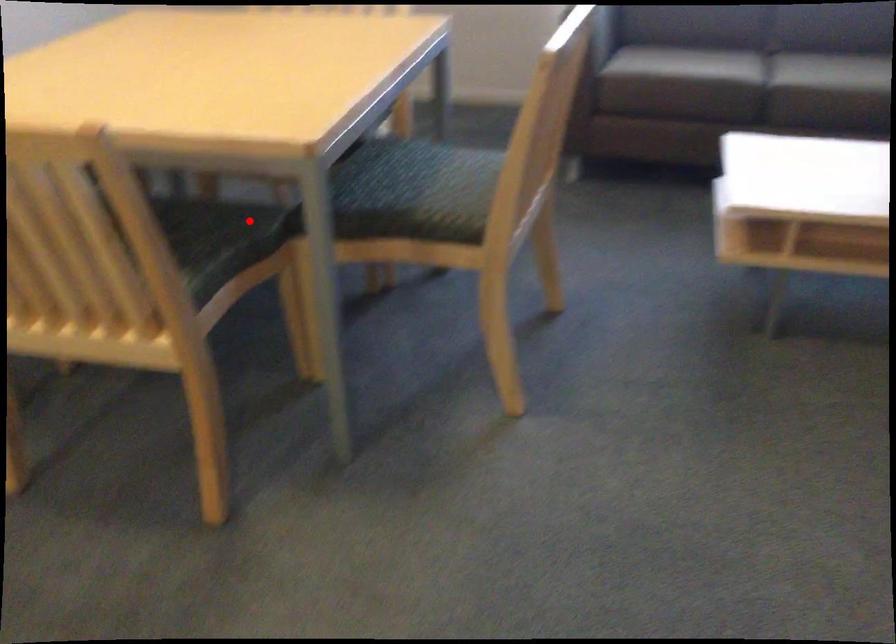
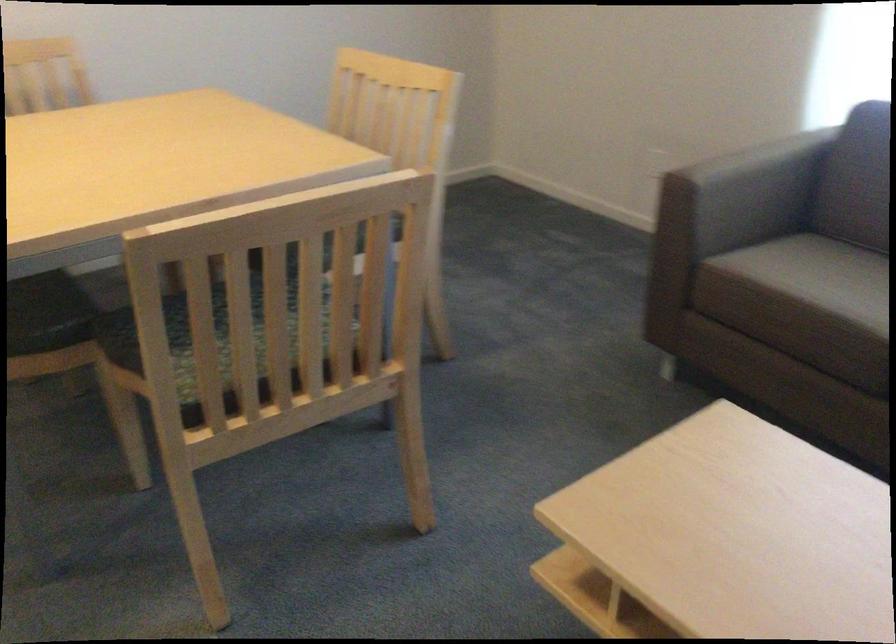
Find the pixel in the second image that matches the highlighted location in the first image.

(47, 313)